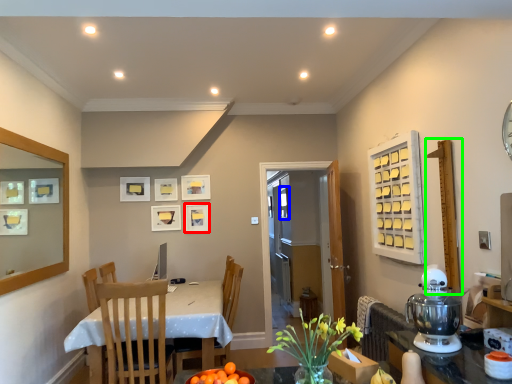
Question: Which object is the closest to the picture frame (highlighted by a red box)? Choose among these: window (highlighted by a blue box) or bulletin board (highlighted by a green box).

Choices:
 (A) window
 (B) bulletin board

Answer: (A)